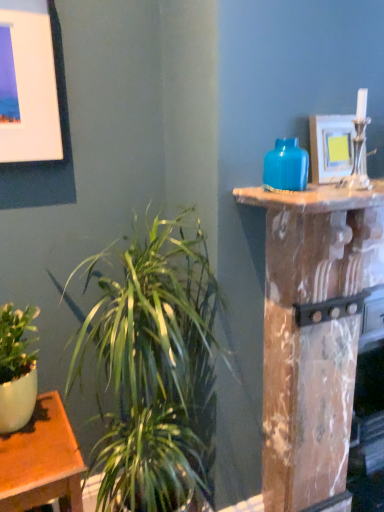
Question: Is matte white picture frame at upper right, the 1th picture frame in the right-to-left sequence, to the left of matte blue vase at upper right from the viewer's perspective?

Choices:
 (A) no
 (B) yes

Answer: (A)

Question: Is matte white picture frame at upper right, the 1th picture frame in the right-to-left sequence, wider than matte blue vase at upper right?

Choices:
 (A) no
 (B) yes

Answer: (A)

Question: Does matte white picture frame at upper right, the 1th picture frame in the right-to-left sequence, touch matte blue vase at upper right?

Choices:
 (A) yes
 (B) no

Answer: (B)

Question: Can you confirm if matte white picture frame at upper right, the 1th picture frame in the right-to-left sequence, is smaller than matte blue vase at upper right?

Choices:
 (A) yes
 (B) no

Answer: (B)

Question: Is matte white picture frame at upper right, the 1th picture frame in the right-to-left sequence, behind matte blue vase at upper right?

Choices:
 (A) yes
 (B) no

Answer: (A)

Question: Considering the positions of matte white picture frame at upper right, which is the 2th picture frame in left-to-right order, and green leafy plant at center in the image, is matte white picture frame at upper right, which is the 2th picture frame in left-to-right order, bigger or smaller than green leafy plant at center?

Choices:
 (A) small
 (B) big

Answer: (A)

Question: Is matte white picture frame at upper right, the 1th picture frame in the right-to-left sequence, wider or thinner than green leafy plant at center?

Choices:
 (A) thin
 (B) wide

Answer: (A)

Question: Is matte white picture frame at upper right, which is the 2th picture frame in left-to-right order, taller or shorter than green leafy plant at center?

Choices:
 (A) short
 (B) tall

Answer: (A)

Question: Is matte white picture frame at upper right, which is the 2th picture frame in left-to-right order, situated inside green leafy plant at center or outside?

Choices:
 (A) inside
 (B) outside

Answer: (B)

Question: Considering the relative positions of green leafy plant at center and matte white picture frame at upper left, which is the 2th picture frame in right-to-left order, in the image provided, is green leafy plant at center to the left or to the right of matte white picture frame at upper left, which is the 2th picture frame in right-to-left order,?

Choices:
 (A) left
 (B) right

Answer: (B)

Question: Does point (122, 312) appear closer or farther from the camera than point (36, 19)?

Choices:
 (A) farther
 (B) closer

Answer: (A)

Question: In the image, is green leafy plant at center positioned in front of or behind matte white picture frame at upper left, which is the 2th picture frame in right-to-left order?

Choices:
 (A) behind
 (B) front

Answer: (B)

Question: Looking at the image, does green leafy plant at center seem bigger or smaller compared to matte white picture frame at upper left, which is the 2th picture frame in right-to-left order?

Choices:
 (A) small
 (B) big

Answer: (B)

Question: From the image's perspective, relative to matte white picture frame at upper left, the first picture frame from the left, is matte blue vase at upper right above or below?

Choices:
 (A) below
 (B) above

Answer: (A)

Question: Considering the relative positions of matte blue vase at upper right and matte white picture frame at upper left, which is the 2th picture frame in right-to-left order, in the image provided, is matte blue vase at upper right to the left or to the right of matte white picture frame at upper left, which is the 2th picture frame in right-to-left order,?

Choices:
 (A) right
 (B) left

Answer: (A)